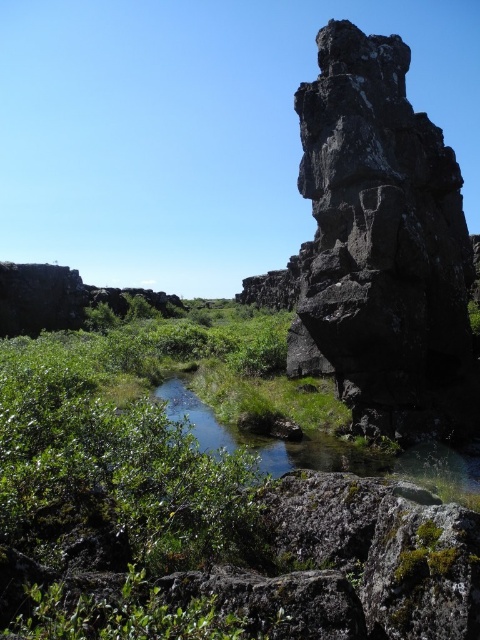
You are a hiker who wants to cross the stream safely. You notice the green leafy shrubs at center and the black rough rock at right. Which object is taller, and would stepping on the shrubs be riskier than stepping on the rock?

The black rough rock at right is taller than the green leafy shrubs at center. Stepping on the green leafy shrubs at center might be riskier because they are shorter and could be more fragile, while the rock is taller and sturdier, providing a more stable footing.

You are standing at the camera position observing the landscape. Which of the two points, point (1, 488) or point (404, 163), is nearer to you?

Point (1, 488) is closer to the camera than point (404, 163).

You are a hiker who wants to cross the stream without getting your boots wet. The green leafy shrubs at center are on the other side. How far apart are the shrubs from your current position?

The green leafy shrubs at center are 21.44 feet away from your current position.